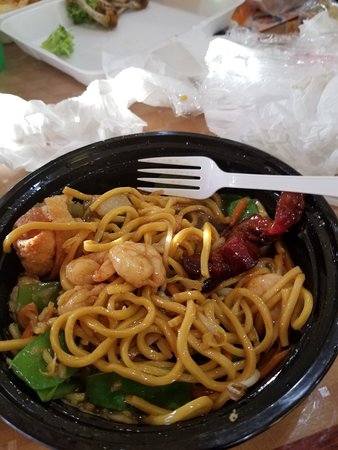
Identify the location of fork. (224, 179).